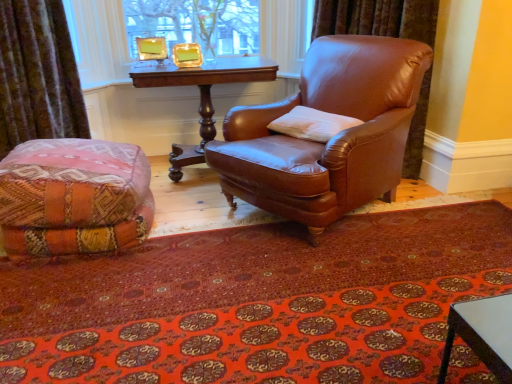
Question: Are multicolored woven ottoman at lower left and white soft pillow at center far apart?

Choices:
 (A) no
 (B) yes

Answer: (B)

Question: From a real-world perspective, is multicolored woven ottoman at lower left on white soft pillow at center?

Choices:
 (A) yes
 (B) no

Answer: (B)

Question: Is multicolored woven ottoman at lower left positioned with its back to white soft pillow at center?

Choices:
 (A) no
 (B) yes

Answer: (A)

Question: Considering the relative positions of multicolored woven ottoman at lower left and white soft pillow at center in the image provided, is multicolored woven ottoman at lower left to the left of white soft pillow at center from the viewer's perspective?

Choices:
 (A) yes
 (B) no

Answer: (A)

Question: From the image's perspective, is multicolored woven ottoman at lower left on white soft pillow at center?

Choices:
 (A) yes
 (B) no

Answer: (B)

Question: From the image's perspective, does multicolored woven ottoman at lower left appear lower than white soft pillow at center?

Choices:
 (A) yes
 (B) no

Answer: (A)

Question: From the image's perspective, is mahogany wood table at center located above multicolored woven ottoman at lower left?

Choices:
 (A) yes
 (B) no

Answer: (A)

Question: Is mahogany wood table at center wider than multicolored woven ottoman at lower left?

Choices:
 (A) no
 (B) yes

Answer: (A)

Question: Is mahogany wood table at center positioned with its back to multicolored woven ottoman at lower left?

Choices:
 (A) no
 (B) yes

Answer: (A)

Question: Is mahogany wood table at center at the left side of multicolored woven ottoman at lower left?

Choices:
 (A) yes
 (B) no

Answer: (B)

Question: Considering the relative positions of mahogany wood table at center and multicolored woven ottoman at lower left in the image provided, is mahogany wood table at center behind multicolored woven ottoman at lower left?

Choices:
 (A) no
 (B) yes

Answer: (B)

Question: From the image's perspective, would you say mahogany wood table at center is shown under multicolored woven ottoman at lower left?

Choices:
 (A) yes
 (B) no

Answer: (B)

Question: Is carpeted mat at lower center positioned in front of mahogany wood table at center?

Choices:
 (A) no
 (B) yes

Answer: (B)